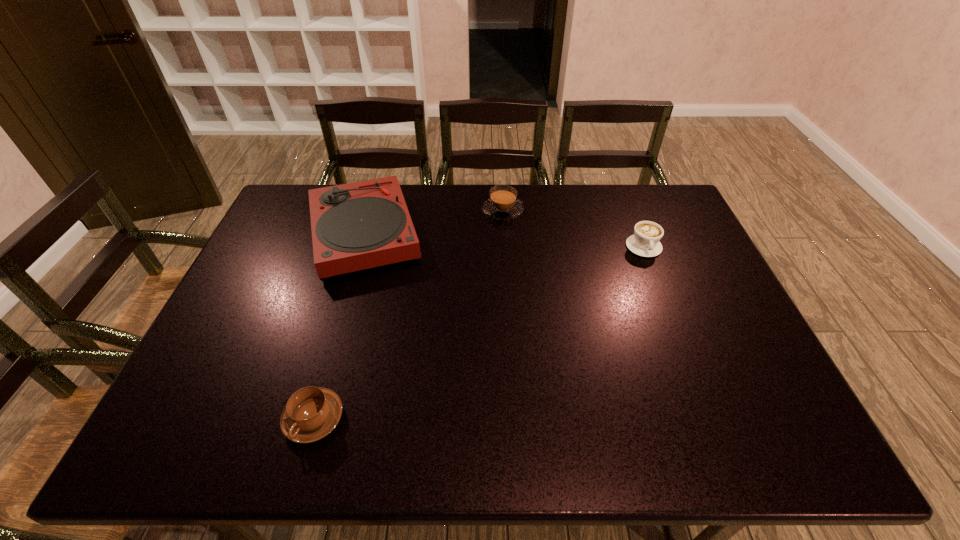
Identify the location of record player that is at the far edge. (355, 226).

This screenshot has width=960, height=540. Find the location of `cappuccino at the far edge`. cappuccino at the far edge is located at coordinates (503, 204).

You are a GUI agent. You are given a task and a screenshot of the screen. Output one action in this format:
    pyautogui.click(x=<x>, y=<y>)
    Task: Click on the object present at the near edge
    The image size is (960, 540).
    Given the screenshot: What is the action you would take?
    pyautogui.click(x=311, y=413)

Identify the location of object at the left edge. [355, 226].

At what (x,y) coordinates should I click in order to perform the action: click on object that is at the right edge. Please return your answer as a coordinate pair (x, y). Looking at the image, I should click on (645, 242).

The height and width of the screenshot is (540, 960). Find the location of `object that is at the far left corner`. object that is at the far left corner is located at coordinates (355, 226).

I want to click on vacant space at the far edge of the desktop, so point(540,185).

Image resolution: width=960 pixels, height=540 pixels. What are the coordinates of `vacant space at the right edge of the desktop` in the screenshot? It's located at (756, 402).

The image size is (960, 540). I want to click on vacant space at the far right corner, so click(630, 199).

You are a GUI agent. You are given a task and a screenshot of the screen. Output one action in this format:
    pyautogui.click(x=<x>, y=<y>)
    Task: Click on the free space between the rightmost object and the nearest object
    This screenshot has width=960, height=540.
    Given the screenshot: What is the action you would take?
    pyautogui.click(x=479, y=333)